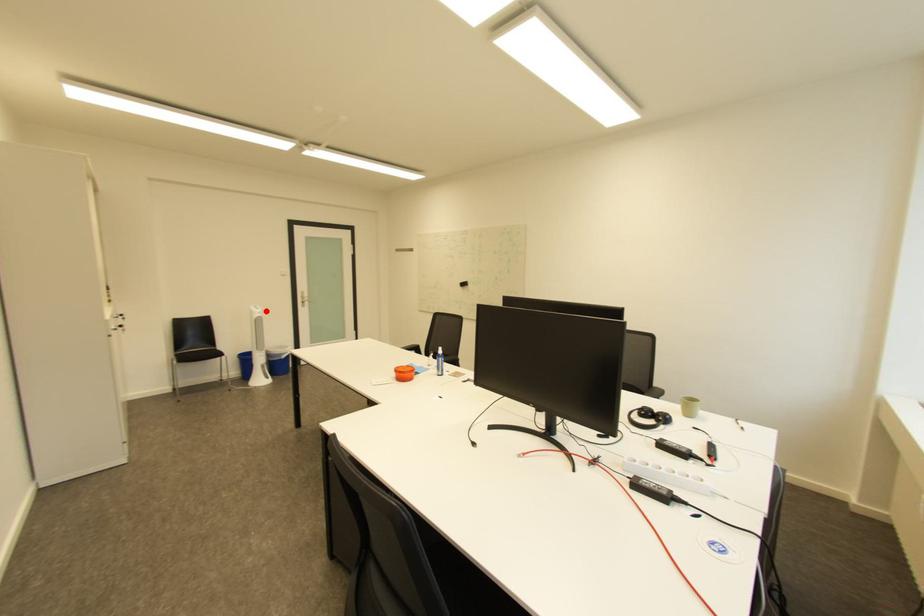
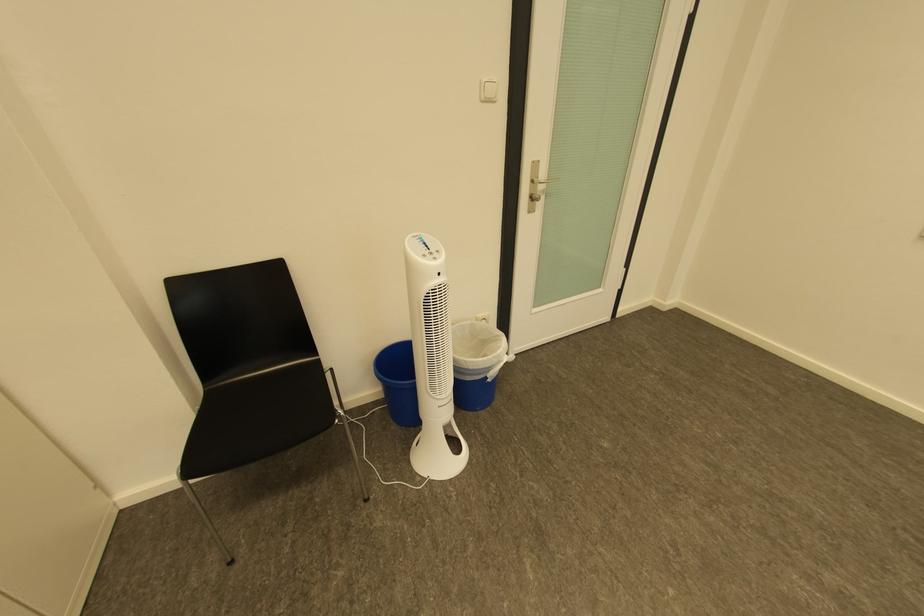
Question: I am providing you with two images of the same scene from different viewpoints. A red point is marked on the first image. At the location where the point appears in image 1, is it still visible in image 2?

Choices:
 (A) Yes
 (B) No

Answer: (A)